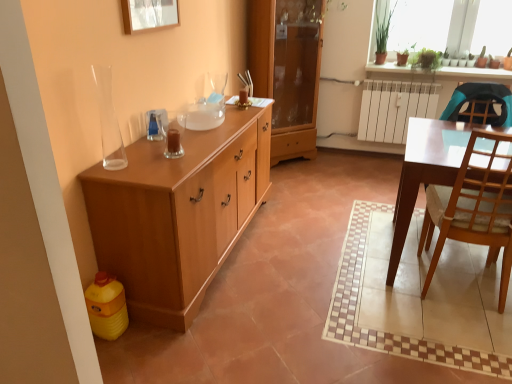
Question: Does green matte plant at upper right, positioned as the second houseplant in left-to-right order, lie behind green leafy plants at upper right?

Choices:
 (A) no
 (B) yes

Answer: (B)

Question: From a real-world perspective, is green matte plant at upper right, the 1th houseplant from the right, under green leafy plants at upper right?

Choices:
 (A) yes
 (B) no

Answer: (A)

Question: Considering the relative sizes of green matte plant at upper right, positioned as the second houseplant in left-to-right order, and green leafy plants at upper right in the image provided, is green matte plant at upper right, positioned as the second houseplant in left-to-right order, taller than green leafy plants at upper right?

Choices:
 (A) yes
 (B) no

Answer: (B)

Question: Is green matte plant at upper right, positioned as the second houseplant in left-to-right order, turned away from green leafy plants at upper right?

Choices:
 (A) yes
 (B) no

Answer: (A)

Question: Does green matte plant at upper right, positioned as the second houseplant in left-to-right order, appear on the left side of green leafy plants at upper right?

Choices:
 (A) yes
 (B) no

Answer: (A)

Question: Considering the positions of green matte plant at upper right, the 1th houseplant from the right, and transparent glass sink at center in the image, is green matte plant at upper right, the 1th houseplant from the right, wider or thinner than transparent glass sink at center?

Choices:
 (A) wide
 (B) thin

Answer: (B)

Question: Does point (425, 51) appear closer or farther from the camera than point (222, 112)?

Choices:
 (A) farther
 (B) closer

Answer: (A)

Question: Based on their sizes in the image, would you say green matte plant at upper right, the 1th houseplant from the right, is bigger or smaller than transparent glass sink at center?

Choices:
 (A) small
 (B) big

Answer: (B)

Question: From a real-world perspective, is green matte plant at upper right, positioned as the second houseplant in left-to-right order, above or below transparent glass sink at center?

Choices:
 (A) above
 (B) below

Answer: (A)

Question: From the image's perspective, is green matte plant at upper right, positioned as the second houseplant in left-to-right order, positioned above or below light brown wooden chair at right?

Choices:
 (A) above
 (B) below

Answer: (A)

Question: In the image, is green matte plant at upper right, the 1th houseplant from the right, on the left side or the right side of light brown wooden chair at right?

Choices:
 (A) left
 (B) right

Answer: (B)

Question: In terms of height, does green matte plant at upper right, the 1th houseplant from the right, look taller or shorter compared to light brown wooden chair at right?

Choices:
 (A) tall
 (B) short

Answer: (B)

Question: Considering the positions of green matte plant at upper right, the 1th houseplant from the right, and light brown wooden chair at right in the image, is green matte plant at upper right, the 1th houseplant from the right, bigger or smaller than light brown wooden chair at right?

Choices:
 (A) big
 (B) small

Answer: (B)

Question: Is green leafy plant at upper right, the first houseplant when ordered from left to right, inside the boundaries of light brown wood cabinet at left, positioned as the 2th cabinetry in back-to-front order, or outside?

Choices:
 (A) outside
 (B) inside

Answer: (A)

Question: Considering the positions of green leafy plant at upper right, the first houseplant when ordered from left to right, and light brown wood cabinet at left, positioned as the 2th cabinetry in back-to-front order, in the image, is green leafy plant at upper right, the first houseplant when ordered from left to right, wider or thinner than light brown wood cabinet at left, positioned as the 2th cabinetry in back-to-front order,?

Choices:
 (A) wide
 (B) thin

Answer: (B)